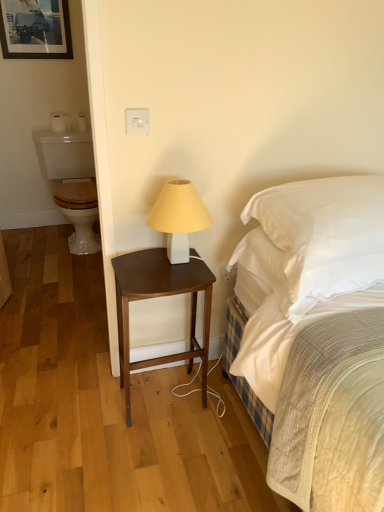
Question: Is white matte table lamp at center turned away from white glossy toilet at left?

Choices:
 (A) yes
 (B) no

Answer: (A)

Question: Can you confirm if white matte table lamp at center is bigger than white glossy toilet at left?

Choices:
 (A) no
 (B) yes

Answer: (A)

Question: From the image's perspective, is white matte table lamp at center above white glossy toilet at left?

Choices:
 (A) no
 (B) yes

Answer: (A)

Question: Does white matte table lamp at center have a smaller size compared to white glossy toilet at left?

Choices:
 (A) no
 (B) yes

Answer: (B)

Question: Is white matte table lamp at center wider than white glossy toilet at left?

Choices:
 (A) no
 (B) yes

Answer: (A)

Question: Considering the relative sizes of white matte table lamp at center and white glossy toilet at left in the image provided, is white matte table lamp at center shorter than white glossy toilet at left?

Choices:
 (A) no
 (B) yes

Answer: (B)

Question: Would you say dark wood nightstand at center is outside white glossy toilet at left?

Choices:
 (A) no
 (B) yes

Answer: (B)

Question: Is dark wood nightstand at center at the right side of white glossy toilet at left?

Choices:
 (A) yes
 (B) no

Answer: (A)

Question: Can you see dark wood nightstand at center touching white glossy toilet at left?

Choices:
 (A) yes
 (B) no

Answer: (B)

Question: Is dark wood nightstand at center shorter than white glossy toilet at left?

Choices:
 (A) yes
 (B) no

Answer: (A)

Question: Can you confirm if dark wood nightstand at center is thinner than white glossy toilet at left?

Choices:
 (A) yes
 (B) no

Answer: (A)

Question: From a real-world perspective, is dark wood nightstand at center physically below white glossy toilet at left?

Choices:
 (A) yes
 (B) no

Answer: (A)

Question: Considering the relative positions of white glossy toilet at left and white satin pillow at upper right in the image provided, is white glossy toilet at left to the left of white satin pillow at upper right from the viewer's perspective?

Choices:
 (A) yes
 (B) no

Answer: (A)